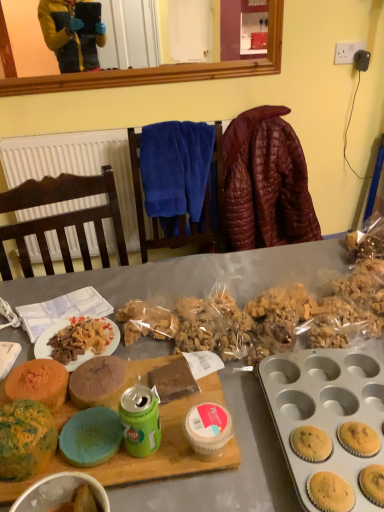
Question: Can you confirm if multicolored sponge cake at center left, the 1th snack when ordered from back to front, is smaller than white textured radiator at upper left?

Choices:
 (A) no
 (B) yes

Answer: (B)

Question: Would you say multicolored sponge cake at center left, which is counted as the second snack, starting from the front, contains white textured radiator at upper left?

Choices:
 (A) no
 (B) yes

Answer: (A)

Question: Is multicolored sponge cake at center left, which is counted as the second snack, starting from the front, bigger than white textured radiator at upper left?

Choices:
 (A) yes
 (B) no

Answer: (B)

Question: Considering the relative positions of multicolored sponge cake at center left, the 1th snack when ordered from back to front, and white textured radiator at upper left in the image provided, is multicolored sponge cake at center left, the 1th snack when ordered from back to front, to the right of white textured radiator at upper left from the viewer's perspective?

Choices:
 (A) no
 (B) yes

Answer: (A)

Question: From the image's perspective, does multicolored sponge cake at center left, the 1th snack when ordered from back to front, appear lower than white textured radiator at upper left?

Choices:
 (A) no
 (B) yes

Answer: (B)

Question: From their relative heights in the image, would you say multicolored sponge cake at center left, the 1th snack when ordered from back to front, is taller or shorter than leather jacket at upper right?

Choices:
 (A) short
 (B) tall

Answer: (A)

Question: Considering the positions of multicolored sponge cake at center left, the 1th snack when ordered from back to front, and leather jacket at upper right in the image, is multicolored sponge cake at center left, the 1th snack when ordered from back to front, wider or thinner than leather jacket at upper right?

Choices:
 (A) wide
 (B) thin

Answer: (B)

Question: Based on their sizes in the image, would you say multicolored sponge cake at center left, the 1th snack when ordered from back to front, is bigger or smaller than leather jacket at upper right?

Choices:
 (A) big
 (B) small

Answer: (B)

Question: Does point (52, 372) appear closer or farther from the camera than point (231, 185)?

Choices:
 (A) closer
 (B) farther

Answer: (A)

Question: In the image, is speckled green cake at center left, arranged as the second snack when viewed from the back, positioned in front of or behind white textured radiator at upper left?

Choices:
 (A) front
 (B) behind

Answer: (A)

Question: From the image's perspective, relative to white textured radiator at upper left, is speckled green cake at center left, which ranks as the first snack in front-to-back order, above or below?

Choices:
 (A) below
 (B) above

Answer: (A)

Question: Does point (9, 407) appear closer or farther from the camera than point (124, 224)?

Choices:
 (A) closer
 (B) farther

Answer: (A)

Question: Based on their sizes in the image, would you say speckled green cake at center left, arranged as the second snack when viewed from the back, is bigger or smaller than white textured radiator at upper left?

Choices:
 (A) big
 (B) small

Answer: (B)

Question: From a real-world perspective, relative to matte ceramic bowl at center, is green metallic can at center vertically above or below?

Choices:
 (A) below
 (B) above

Answer: (B)

Question: In the image, is green metallic can at center on the left side or the right side of matte ceramic bowl at center?

Choices:
 (A) left
 (B) right

Answer: (B)